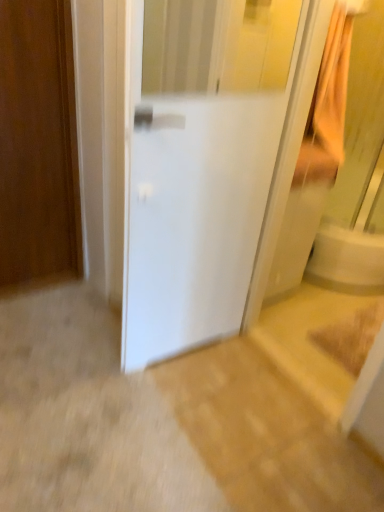
Question: Which direction should I rotate to face white matte refrigerator at center, the second door positioned from the left, — up or down?

Choices:
 (A) up
 (B) down

Answer: (A)

Question: Is wooden door at left, acting as the first door starting from the left, directly adjacent to white matte refrigerator at center, the second door positioned from the left?

Choices:
 (A) no
 (B) yes

Answer: (A)

Question: Is wooden door at left, acting as the first door starting from the left, at the left side of white matte refrigerator at center, the 1th door viewed from the right?

Choices:
 (A) yes
 (B) no

Answer: (A)

Question: Considering the relative sizes of wooden door at left, acting as the first door starting from the left, and white matte refrigerator at center, the second door positioned from the left, in the image provided, is wooden door at left, acting as the first door starting from the left, wider than white matte refrigerator at center, the second door positioned from the left,?

Choices:
 (A) no
 (B) yes

Answer: (A)

Question: Considering the relative sizes of wooden door at left, acting as the first door starting from the left, and white matte refrigerator at center, the 1th door viewed from the right, in the image provided, is wooden door at left, acting as the first door starting from the left, thinner than white matte refrigerator at center, the 1th door viewed from the right,?

Choices:
 (A) yes
 (B) no

Answer: (A)

Question: Could white matte refrigerator at center, the second door positioned from the left, be considered to be inside wooden door at left, acting as the first door starting from the left?

Choices:
 (A) no
 (B) yes

Answer: (A)

Question: Is the position of wooden door at left, the second door when ordered from right to left, more distant than that of white matte refrigerator at center, the second door positioned from the left?

Choices:
 (A) yes
 (B) no

Answer: (A)

Question: Is wooden door at left, the second door when ordered from right to left, at the back of white matte refrigerator at center, the 1th door viewed from the right?

Choices:
 (A) yes
 (B) no

Answer: (A)

Question: Is white matte refrigerator at center, the 1th door viewed from the right, further to camera compared to wooden door at left, the second door when ordered from right to left?

Choices:
 (A) no
 (B) yes

Answer: (A)

Question: Is wooden door at left, acting as the first door starting from the left, a part of white matte refrigerator at center, the 1th door viewed from the right?

Choices:
 (A) yes
 (B) no

Answer: (B)

Question: Is white matte refrigerator at center, the second door positioned from the left, positioned before wooden door at left, acting as the first door starting from the left?

Choices:
 (A) no
 (B) yes

Answer: (B)

Question: From a real-world perspective, is white matte refrigerator at center, the 1th door viewed from the right, beneath wooden door at left, acting as the first door starting from the left?

Choices:
 (A) no
 (B) yes

Answer: (A)

Question: From the image's perspective, does white matte refrigerator at center, the 1th door viewed from the right, appear lower than wooden door at left, acting as the first door starting from the left?

Choices:
 (A) yes
 (B) no

Answer: (A)

Question: Considering the positions of white matte refrigerator at center, the 1th door viewed from the right, and wooden door at left, the second door when ordered from right to left, in the image, is white matte refrigerator at center, the 1th door viewed from the right, wider or thinner than wooden door at left, the second door when ordered from right to left,?

Choices:
 (A) thin
 (B) wide

Answer: (B)